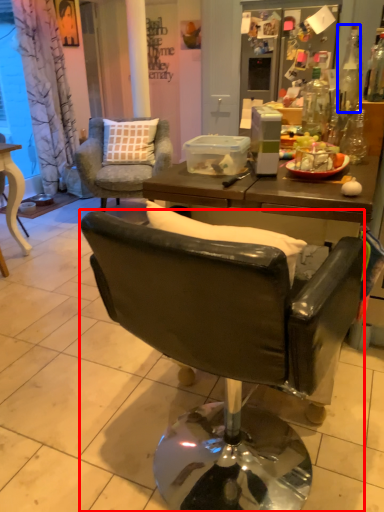
Question: Which point is further to the camera, chair (highlighted by a red box) or bottle (highlighted by a blue box)?

Choices:
 (A) chair
 (B) bottle

Answer: (B)